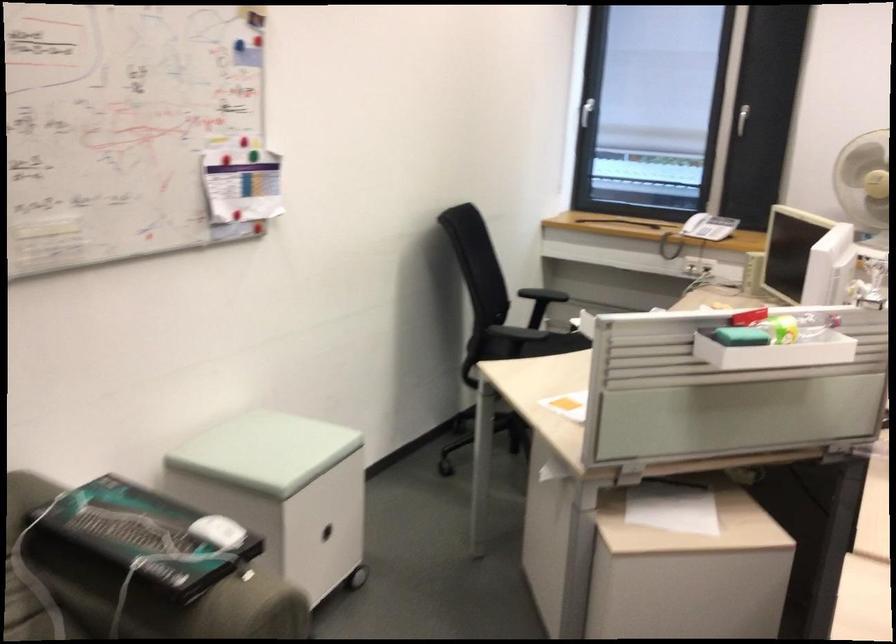
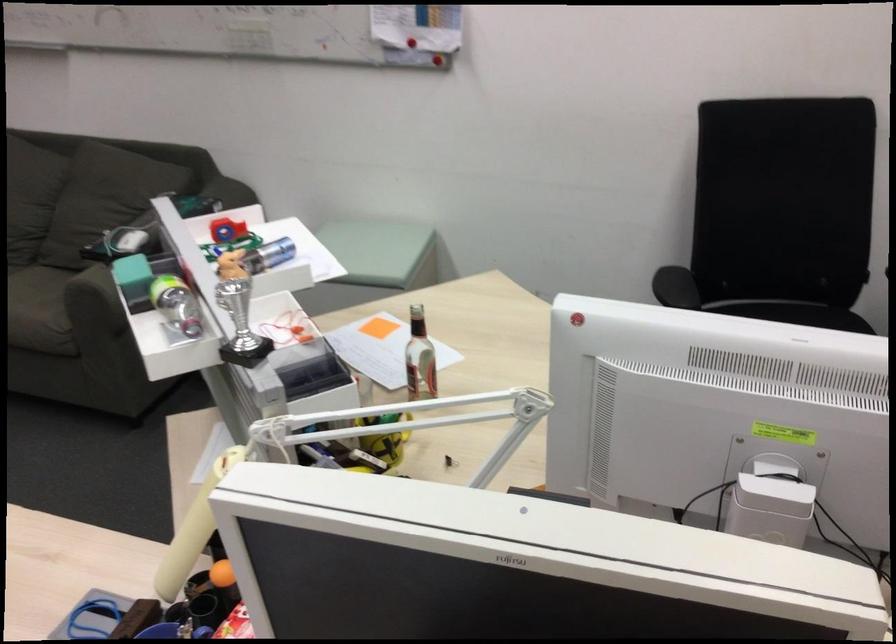
In the second image, find the point that corresponds to point (213, 184) in the first image.

(401, 13)